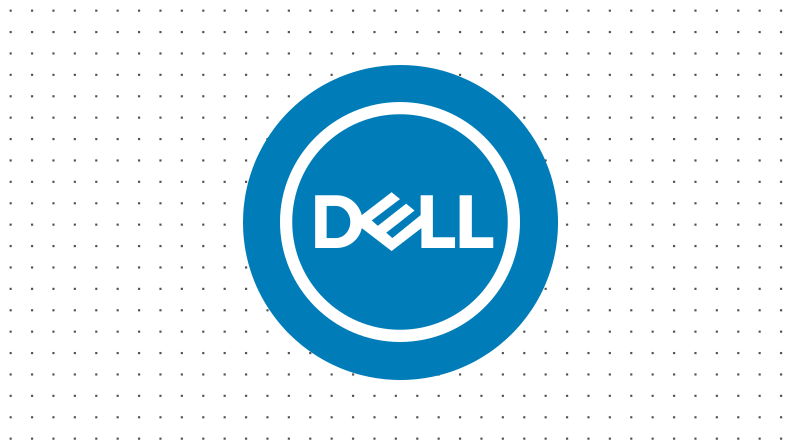
Identify the location of pegboard. The image size is (793, 445). (194, 117).